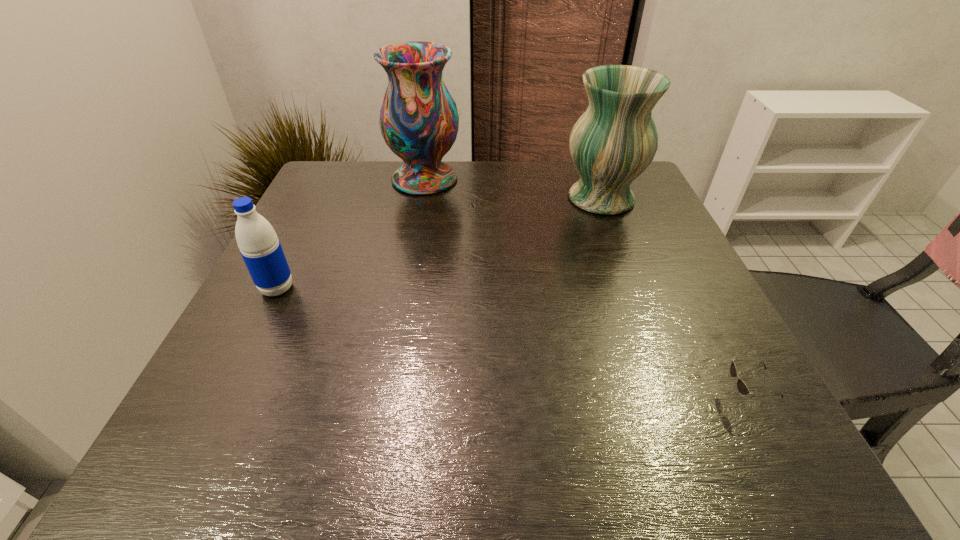
Where is `blank region between the right vase and the water bottle`? blank region between the right vase and the water bottle is located at coordinates (439, 244).

Locate an element on the screen. blank region between the left vase and the shortest object is located at coordinates (585, 288).

Locate an element on the screen. free space between the third object from right to left and the third farthest object is located at coordinates pos(351,234).

Find the location of a particular element. The image size is (960, 540). unoccupied position between the right vase and the second nearest object is located at coordinates (439, 244).

Select which object is the second closest to the right vase. Please provide its 2D coordinates. Your answer should be formatted as a tuple, i.e. [(x, y)], where the tuple contains the x and y coordinates of a point satisfying the conditions above.

[(742, 387)]

Point out which object is positioned as the second nearest to the leftmost object. Please provide its 2D coordinates. Your answer should be formatted as a tuple, i.e. [(x, y)], where the tuple contains the x and y coordinates of a point satisfying the conditions above.

[(613, 142)]

Where is `vacant region that satisfies the following two spatial constraints: 1. on the back side of the leftmost object; 2. on the right side of the third object from right to left`? The height and width of the screenshot is (540, 960). vacant region that satisfies the following two spatial constraints: 1. on the back side of the leftmost object; 2. on the right side of the third object from right to left is located at coordinates (331, 179).

Locate an element on the screen. The image size is (960, 540). vacant space that satisfies the following two spatial constraints: 1. on the back side of the right vase; 2. on the right side of the second shortest object is located at coordinates (322, 198).